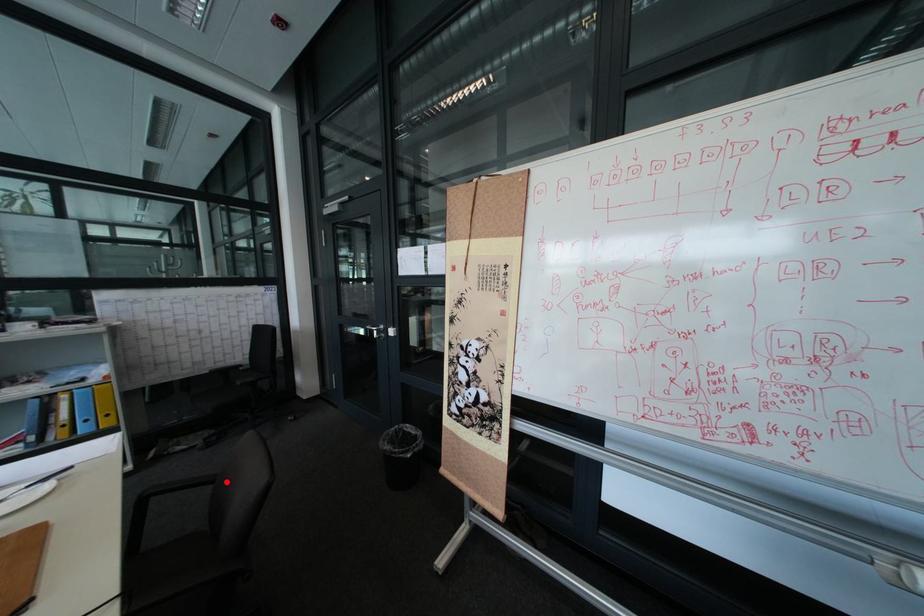
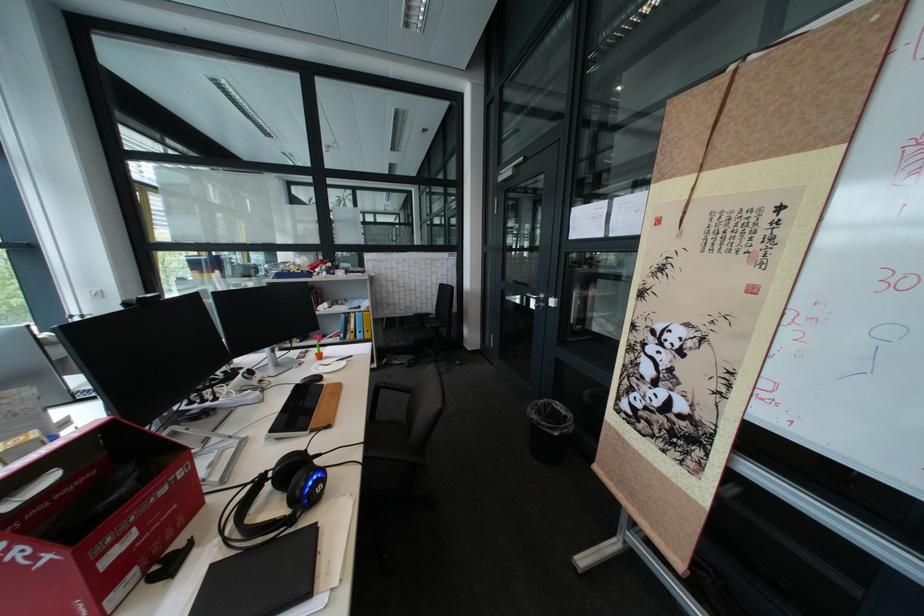
In the second image, find the point that corresponds to the highlighted location in the first image.

(423, 392)